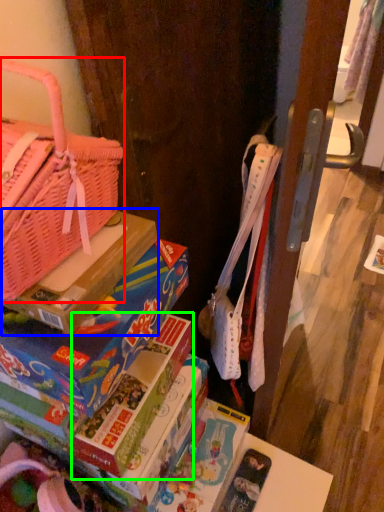
Question: Which is nearer to the handbag (highlighted by a red box)? cardboard box (highlighted by a blue box) or paperback book (highlighted by a green box).

Choices:
 (A) cardboard box
 (B) paperback book

Answer: (A)